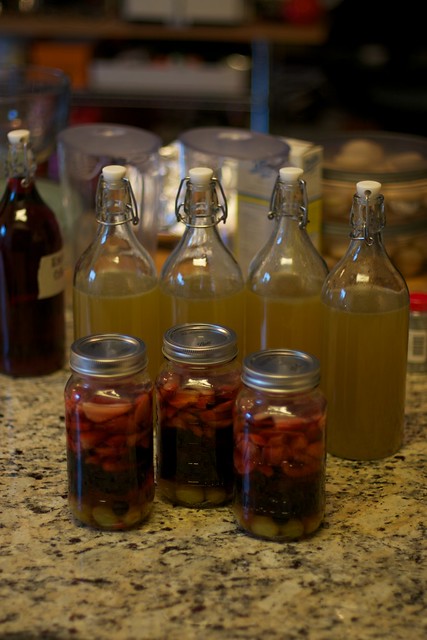
Find the location of a particular element. The image size is (427, 640). jar is located at coordinates (285, 409).